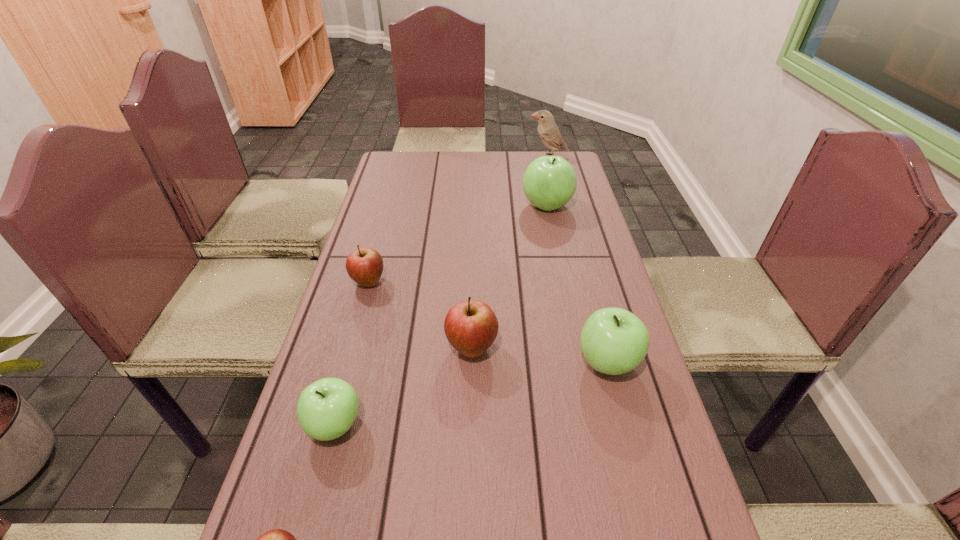
Where is `bird that is positioned at the right edge`? bird that is positioned at the right edge is located at coordinates (549, 133).

Identify the location of object that is at the far right corner. (549, 133).

In the image, there is a desktop. Where is `vacant area at the far edge`? The height and width of the screenshot is (540, 960). vacant area at the far edge is located at coordinates (494, 172).

Where is `vacant space at the left edge of the desktop`? The image size is (960, 540). vacant space at the left edge of the desktop is located at coordinates 403,240.

Locate an element on the screen. free spot at the right edge of the desktop is located at coordinates (608, 273).

The width and height of the screenshot is (960, 540). I want to click on free point at the far left corner, so tap(420, 158).

Where is `free spot at the far right corner of the desktop`? The height and width of the screenshot is (540, 960). free spot at the far right corner of the desktop is located at coordinates (572, 154).

The image size is (960, 540). Find the location of `free space between the tallest apple and the second smallest green apple`. free space between the tallest apple and the second smallest green apple is located at coordinates click(x=577, y=284).

Find the location of `free area in between the nearest green apple and the farthest object`. free area in between the nearest green apple and the farthest object is located at coordinates (442, 291).

Image resolution: width=960 pixels, height=540 pixels. In order to click on free spot between the leftmost green apple and the fourth apple from left to right in this screenshot , I will do `click(403, 387)`.